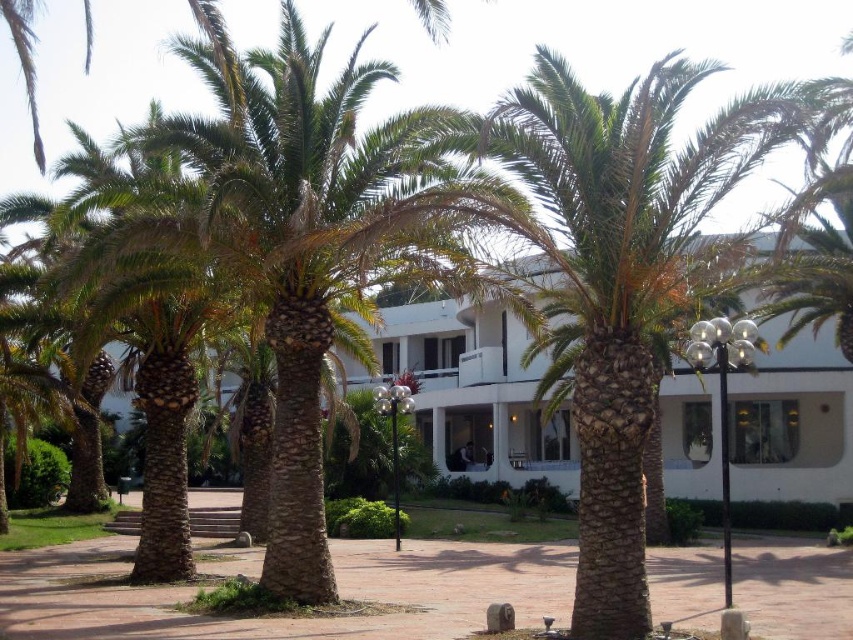
Question: Can you confirm if green textured palm tree at center is wider than white smooth building at center?

Choices:
 (A) yes
 (B) no

Answer: (B)

Question: Which point is closer to the camera?

Choices:
 (A) white smooth building at center
 (B) green textured palm tree at center

Answer: (B)

Question: Is green textured palm tree at center smaller than white smooth building at center?

Choices:
 (A) yes
 (B) no

Answer: (B)

Question: Among these objects, which one is nearest to the camera?

Choices:
 (A) white smooth building at center
 (B) green textured palm tree at center

Answer: (B)

Question: From the image, what is the correct spatial relationship of green textured palm tree at center in relation to white smooth building at center?

Choices:
 (A) above
 (B) below

Answer: (A)